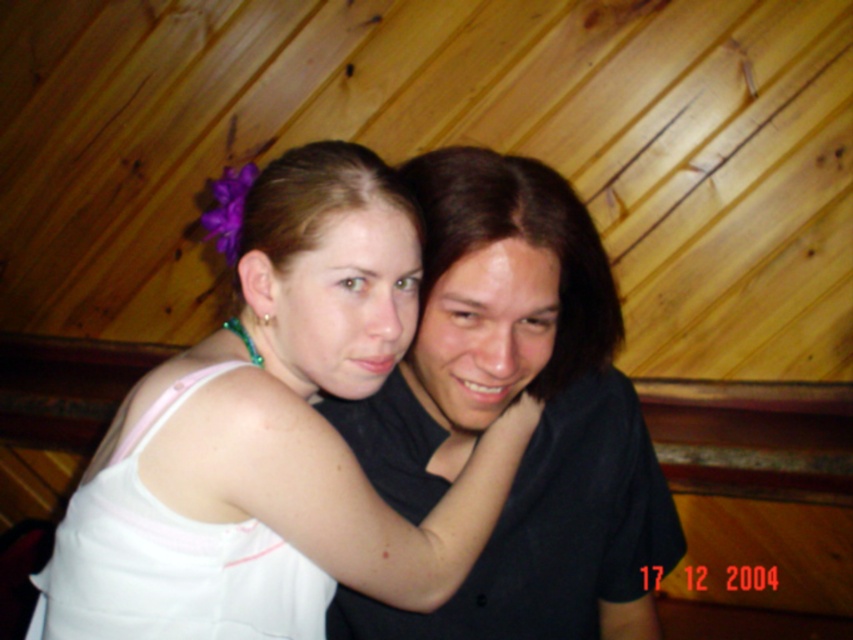
Question: Which point is closer to the camera?

Choices:
 (A) (349, 493)
 (B) (645, 438)

Answer: (A)

Question: Is white fabric at center closer to camera compared to black matte shirt at center?

Choices:
 (A) yes
 (B) no

Answer: (A)

Question: Considering the relative positions of white fabric at center and black matte shirt at center in the image provided, where is white fabric at center located with respect to black matte shirt at center?

Choices:
 (A) right
 (B) left

Answer: (B)

Question: Does white fabric at center have a lesser width compared to black matte shirt at center?

Choices:
 (A) yes
 (B) no

Answer: (B)